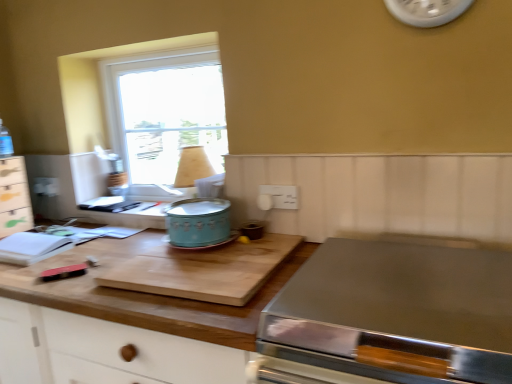
Question: From the image's perspective, is stainless steel cooktop at lower right located above or below white wood drawer at left?

Choices:
 (A) above
 (B) below

Answer: (B)

Question: Based on their positions, is stainless steel cooktop at lower right located to the left or right of white wood drawer at left?

Choices:
 (A) right
 (B) left

Answer: (A)

Question: Estimate the real-world distances between objects in this image. Which object is farther from the stainless steel cooktop at lower right?

Choices:
 (A) wooden cutting board at center
 (B) wooden cutting board at center
 (C) white plastic clock at upper right
 (D) clear glass window at upper left
 (E) white wood drawer at left

Answer: (E)

Question: Which of these objects is positioned farthest from the white wood drawer at left?

Choices:
 (A) stainless steel cooktop at lower right
 (B) wooden cutting board at center
 (C) clear glass window at upper left
 (D) teal enamel crock pot at center
 (E) wooden cutting board at center

Answer: (A)